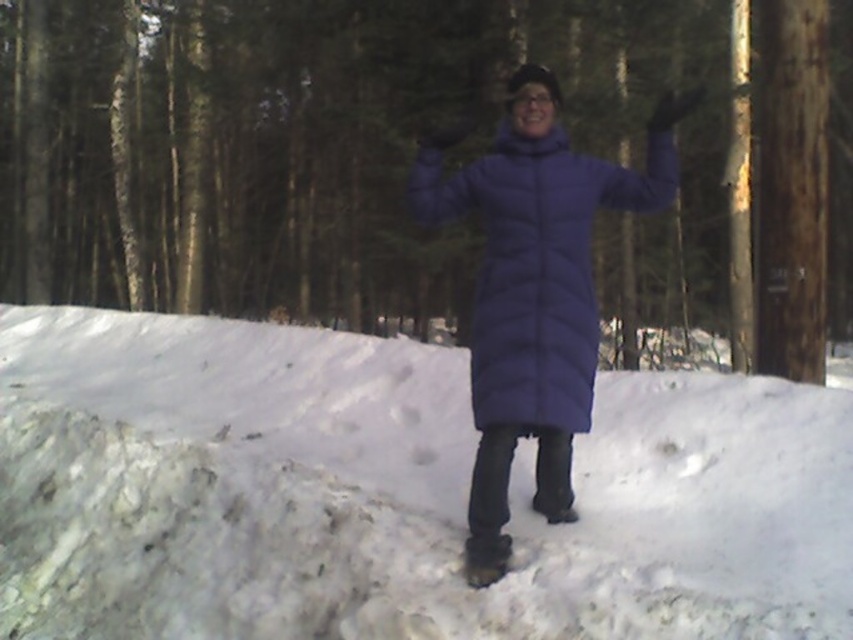
Who is positioned more to the right, brown wood pole at center right or matte blue puffer jacket at center?

Positioned to the right is matte blue puffer jacket at center.

Does brown wood pole at center right have a larger size compared to matte blue puffer jacket at center?

Correct, brown wood pole at center right is larger in size than matte blue puffer jacket at center.

This screenshot has height=640, width=853. Identify the location of brown wood pole at center right. (412, 157).

Where is `brown wood pole at center right`? The width and height of the screenshot is (853, 640). brown wood pole at center right is located at coordinates tap(412, 157).

Is brown wood pole at center right taller than white fluffy snow at center?

Correct, brown wood pole at center right is much taller as white fluffy snow at center.

Consider the image. Who is more forward, [422,108] or [389,404]?

Point [389,404]

The width and height of the screenshot is (853, 640). I want to click on brown wood pole at center right, so click(412, 157).

Image resolution: width=853 pixels, height=640 pixels. I want to click on white fluffy snow at center, so [x=392, y=492].

Is white fluffy snow at center smaller than matte blue puffer jacket at center?

Incorrect, white fluffy snow at center is not smaller in size than matte blue puffer jacket at center.

Which is behind, point (306, 582) or point (498, 404)?

The point (306, 582) is more distant.

Locate an element on the screen. The width and height of the screenshot is (853, 640). white fluffy snow at center is located at coordinates (392, 492).